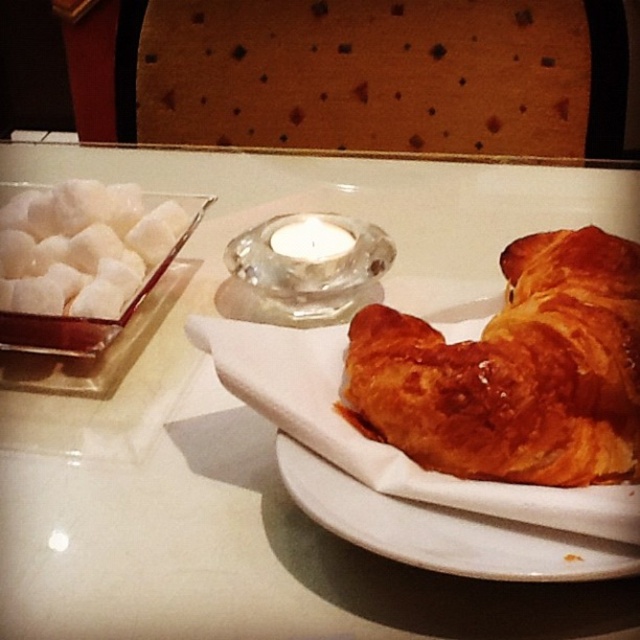
Looking at this image, is white sugar cubes at left positioned at the back of translucent glass candle at center?

No, white sugar cubes at left is in front of translucent glass candle at center.

Which is in front, point (164, 204) or point (342, 241)?

Point (342, 241) is more forward.

At what (x,y) coordinates should I click in order to perform the action: click on white sugar cubes at left. Please return your answer as a coordinate pair (x, y). This screenshot has width=640, height=640. Looking at the image, I should click on (83, 246).

Between point (474, 435) and point (513, 524), which one is positioned behind?

The point (474, 435) is behind.

Does golden brown flaky croissant at center have a greater height compared to white ceramic plate at lower right?

Yes.

Who is more forward, (396, 326) or (556, 566)?

Point (556, 566) is in front.

I want to click on golden brown flaky croissant at center, so click(x=515, y=371).

Can you confirm if golden brown flaky croissant at center is wider than white sugar cubes at left?

No.

Which is above, golden brown flaky croissant at center or white sugar cubes at left?

white sugar cubes at left

Does point (381, 358) lie behind point (67, 237)?

That is False.

Locate an element on the screen. This screenshot has width=640, height=640. golden brown flaky croissant at center is located at coordinates (515, 371).